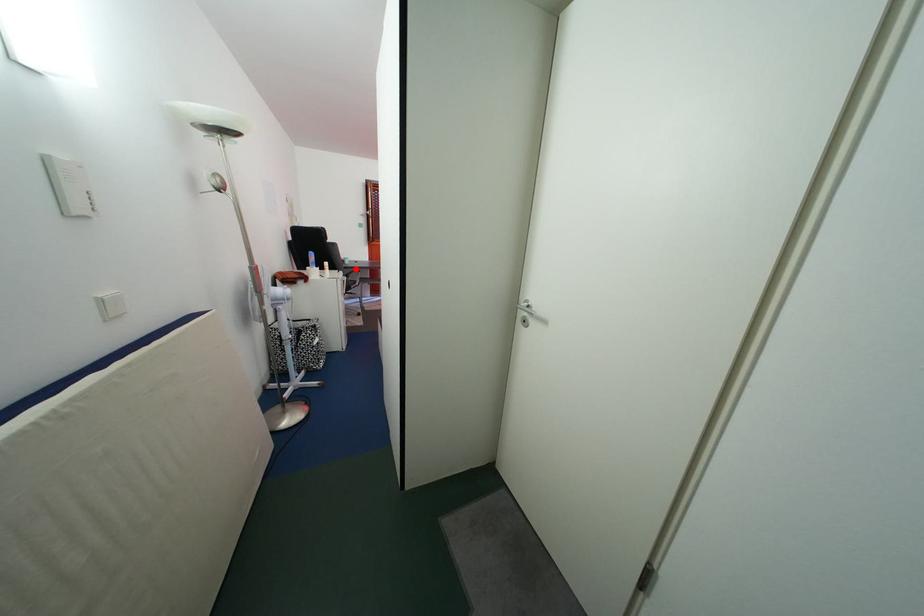
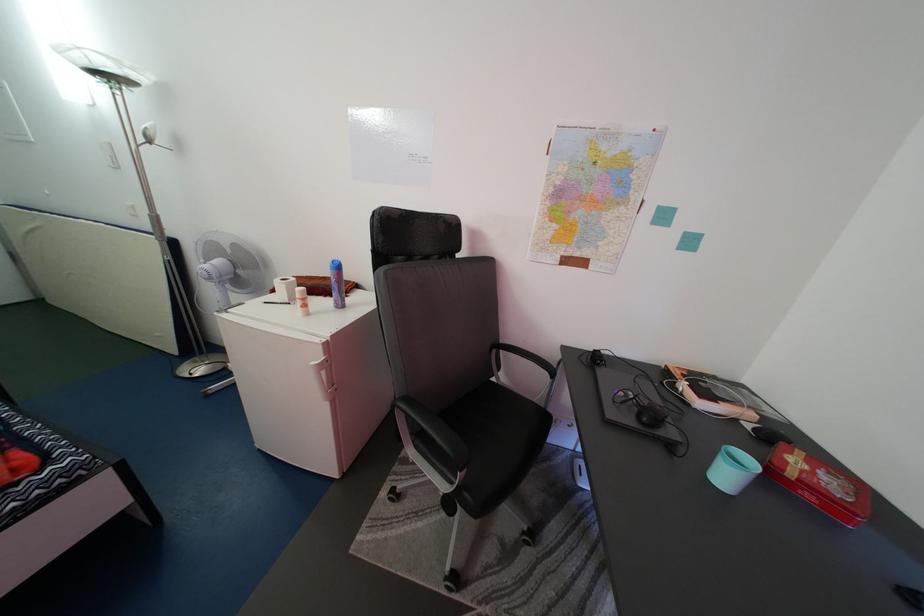
In the second image, find the point that corresponds to the highlighted location in the first image.

(735, 484)